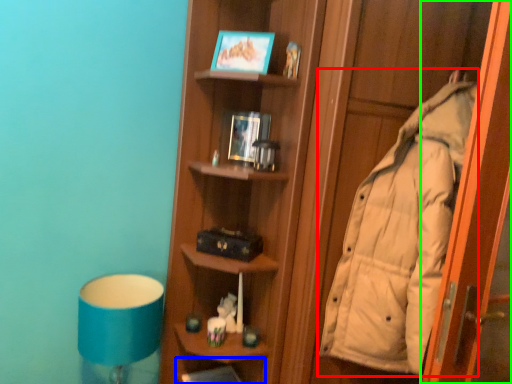
Question: Which is farther away from coat (highlighted by a red box)? shelf (highlighted by a blue box) or screen door (highlighted by a green box)?

Choices:
 (A) shelf
 (B) screen door

Answer: (A)